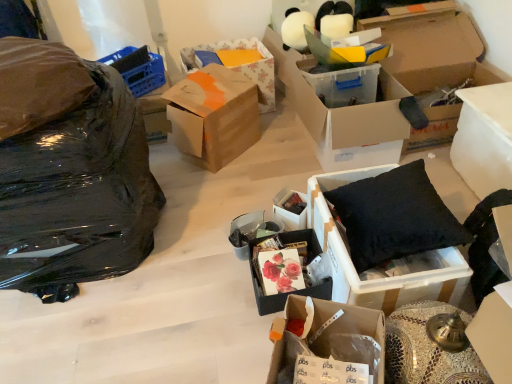
Question: In terms of width, does matte black box at center, placed as the 4th box when sorted from left to right, look wider or thinner when compared to black fabric cushion at right, the 4th box positioned from the right?

Choices:
 (A) thin
 (B) wide

Answer: (A)

Question: From a real-world perspective, is matte black box at center, placed as the 4th box when sorted from left to right, positioned above or below black fabric cushion at right, the 4th box positioned from the right?

Choices:
 (A) above
 (B) below

Answer: (B)

Question: Which is nearer to the matte black box at center, placed as the 4th box when sorted from left to right?

Choices:
 (A) cardboard box at center, which is the 5th box in left-to-right order
 (B) white plastic container at right, the ninth box positioned from the left
 (C) black fabric cushion at right, positioned as the 6th box in left-to-right order
 (D) black plastic bag at left
 (E) transparent plastic box at center, which ranks as the 3th box in right-to-left order

Answer: (C)

Question: Considering the real-world distances, which object is closest to the matte floral print box at center, acting as the seventh box starting from the right?

Choices:
 (A) black plastic bag at left
 (B) cardboard box at center, the 5th box in the right-to-left sequence
 (C) matte black box at center, placed as the 4th box when sorted from left to right
 (D) floral paper box at center, which appears as the second box when viewed from the left
 (E) white plastic container at right, which is the 1th box in right-to-left order

Answer: (C)